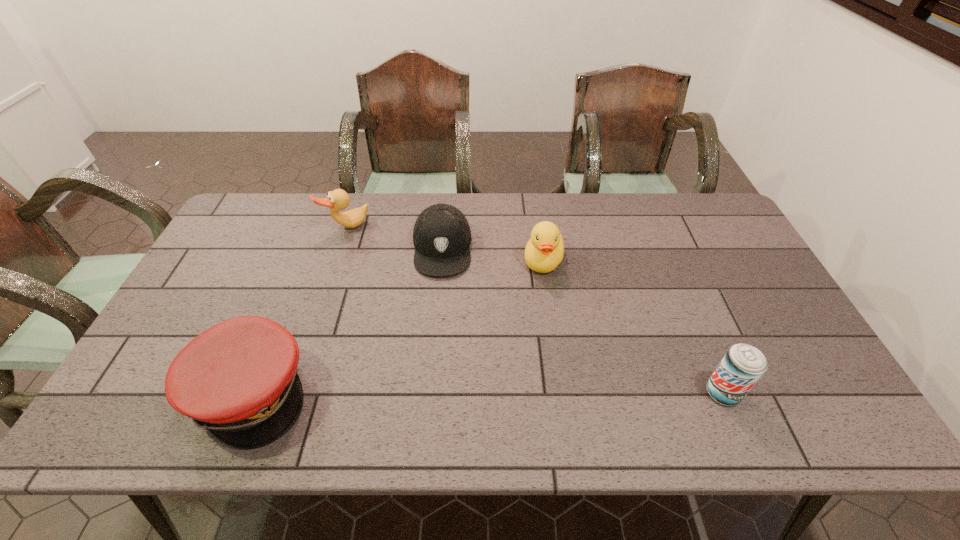
This screenshot has width=960, height=540. Find the location of `the left cap`. the left cap is located at coordinates (238, 379).

What are the coordinates of `the rightmost object` in the screenshot? It's located at (743, 365).

This screenshot has width=960, height=540. Find the location of `the fourth object from left to right`. the fourth object from left to right is located at coordinates (544, 251).

At what (x,y) coordinates should I click in order to perform the action: click on the nearer duck. Please return your answer as a coordinate pair (x, y). This screenshot has width=960, height=540. Looking at the image, I should click on (544, 251).

The height and width of the screenshot is (540, 960). In order to click on the third object from left to right in this screenshot , I will do `click(441, 236)`.

Locate an element on the screen. the farther cap is located at coordinates (441, 236).

Locate an element on the screen. The image size is (960, 540). the left duck is located at coordinates (337, 200).

Where is `free region located on the front-facing side of the left cap`? free region located on the front-facing side of the left cap is located at coordinates (469, 392).

Identify the location of vacant space located on the right of the rightmost object. Image resolution: width=960 pixels, height=540 pixels. (781, 393).

At what (x,y) coordinates should I click in order to perform the action: click on vacant space located 0.060m at the beak of the nearer duck. Please return your answer as a coordinate pair (x, y). The height and width of the screenshot is (540, 960). Looking at the image, I should click on (535, 294).